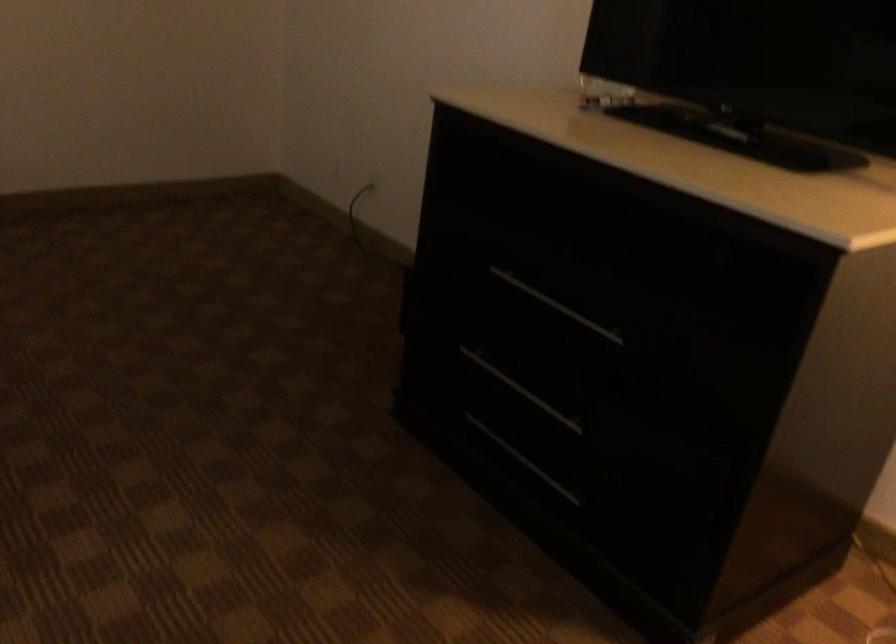
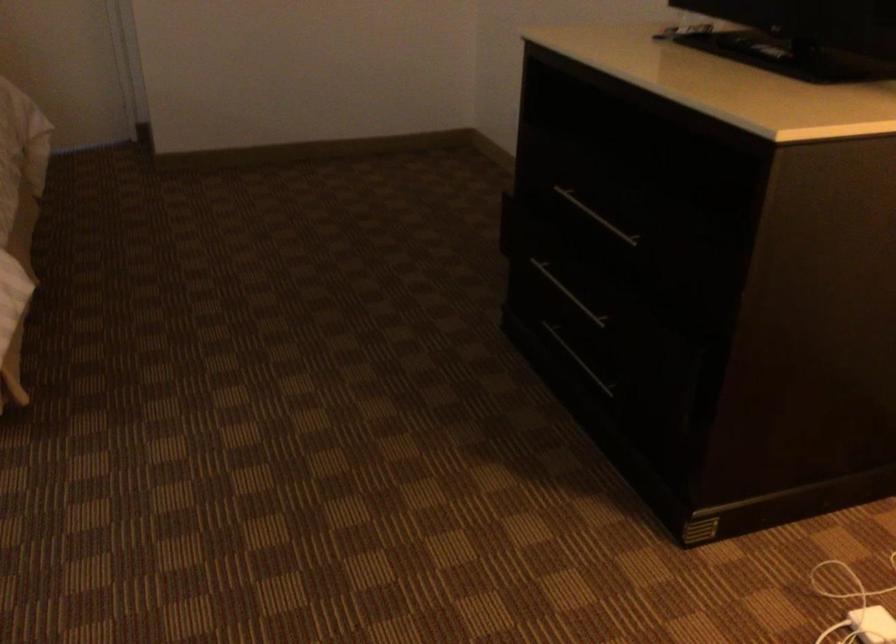
Where in the second image is the point corresponding to point (521, 391) from the first image?

(567, 292)